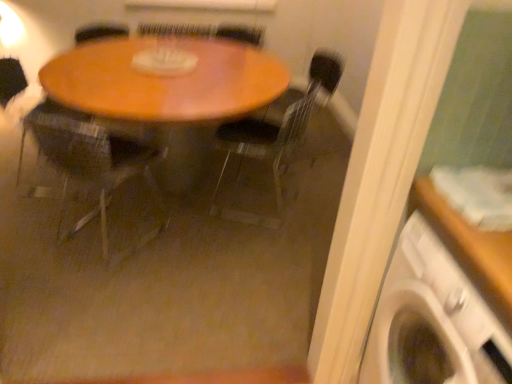
Question: Is white plastic washing machine at lower right at the right side of wooden armchair at center?

Choices:
 (A) no
 (B) yes

Answer: (B)

Question: Is white plastic washing machine at lower right at the left side of wooden armchair at center?

Choices:
 (A) no
 (B) yes

Answer: (A)

Question: Does white plastic washing machine at lower right contain wooden armchair at center?

Choices:
 (A) no
 (B) yes

Answer: (A)

Question: From a real-world perspective, is white plastic washing machine at lower right on top of wooden armchair at center?

Choices:
 (A) no
 (B) yes

Answer: (B)

Question: From a real-world perspective, is white plastic washing machine at lower right physically below wooden armchair at center?

Choices:
 (A) yes
 (B) no

Answer: (B)

Question: Considering their positions, is wooden table at center located in front of or behind wooden chair at center, marked as the second chair in a right-to-left arrangement?

Choices:
 (A) behind
 (B) front

Answer: (A)

Question: In terms of height, does wooden table at center look taller or shorter compared to wooden chair at center, which appears as the first chair when viewed from the left?

Choices:
 (A) tall
 (B) short

Answer: (B)

Question: In terms of size, does wooden table at center appear bigger or smaller than wooden chair at center, marked as the second chair in a right-to-left arrangement?

Choices:
 (A) small
 (B) big

Answer: (B)

Question: In the image, is wooden table at center on the left side or the right side of wooden chair at center, marked as the second chair in a right-to-left arrangement?

Choices:
 (A) left
 (B) right

Answer: (B)

Question: In terms of size, does transparent plastic chair at center, which ranks as the first chair in right-to-left order, appear bigger or smaller than wooden armchair at center?

Choices:
 (A) small
 (B) big

Answer: (B)

Question: From the image's perspective, is transparent plastic chair at center, which ranks as the first chair in right-to-left order, located above or below wooden armchair at center?

Choices:
 (A) below
 (B) above

Answer: (A)

Question: In the image, is transparent plastic chair at center, which ranks as the first chair in right-to-left order, positioned in front of or behind wooden armchair at center?

Choices:
 (A) behind
 (B) front

Answer: (B)

Question: Is transparent plastic chair at center, which ranks as the first chair in right-to-left order, to the left or to the right of wooden armchair at center in the image?

Choices:
 (A) right
 (B) left

Answer: (A)

Question: Considering the positions of white plastic washing machine at lower right and wooden table at center in the image, is white plastic washing machine at lower right wider or thinner than wooden table at center?

Choices:
 (A) wide
 (B) thin

Answer: (B)

Question: Is white plastic washing machine at lower right inside or outside of wooden table at center?

Choices:
 (A) inside
 (B) outside

Answer: (B)